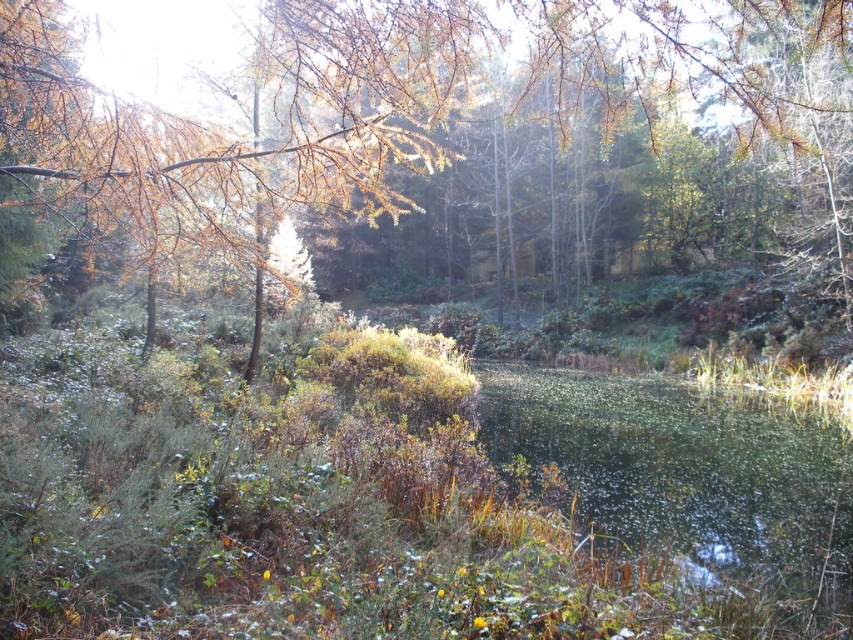
You are standing in the autumn scene described. You see two points marked in the image, point A at coordinates point (648, 108) and point B at coordinates point (554, 369). Which point is closer to you?

Point A at coordinates point (648, 108) is closer to the viewer than point B at coordinates point (554, 369).